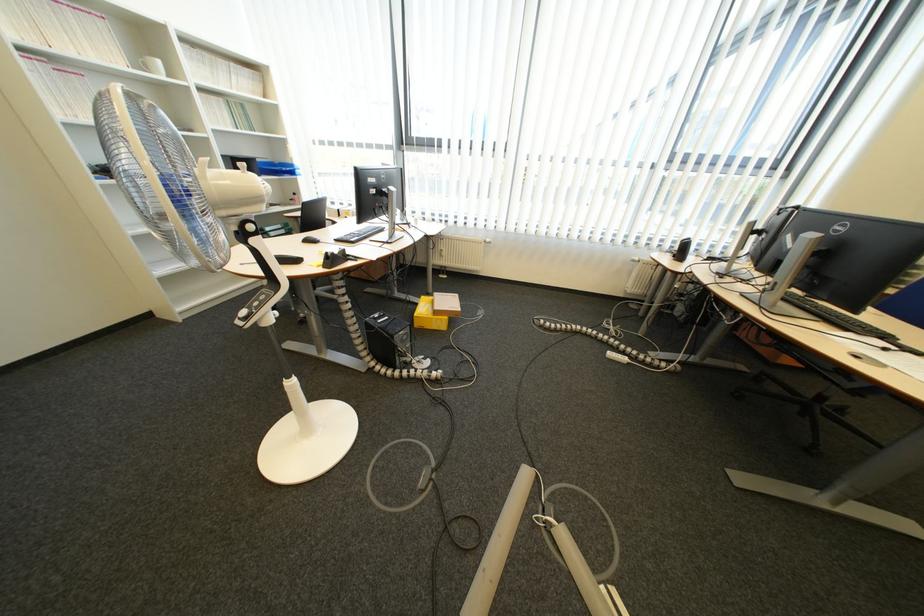
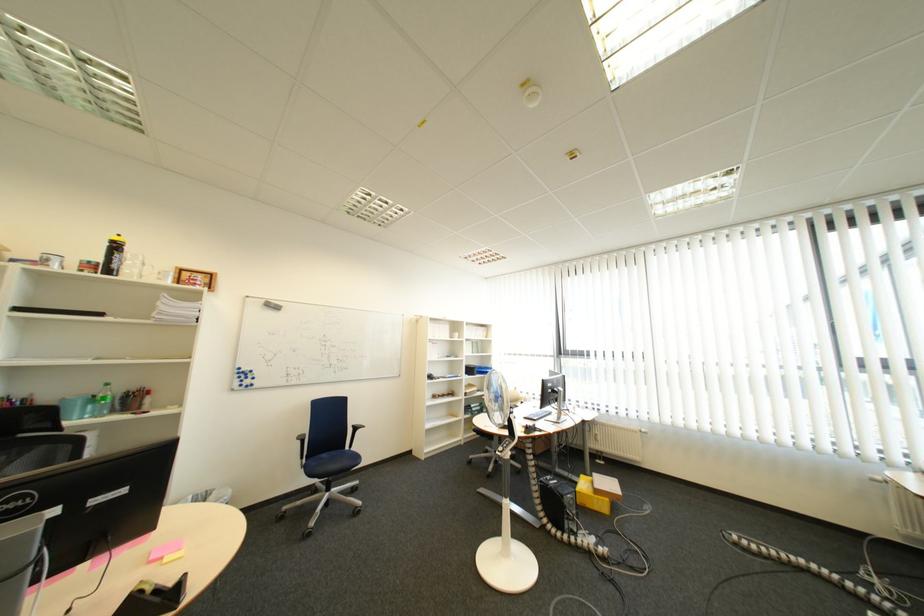
Where in the second image is the point corresponding to pixel 418 339 from the first image?

(585, 503)